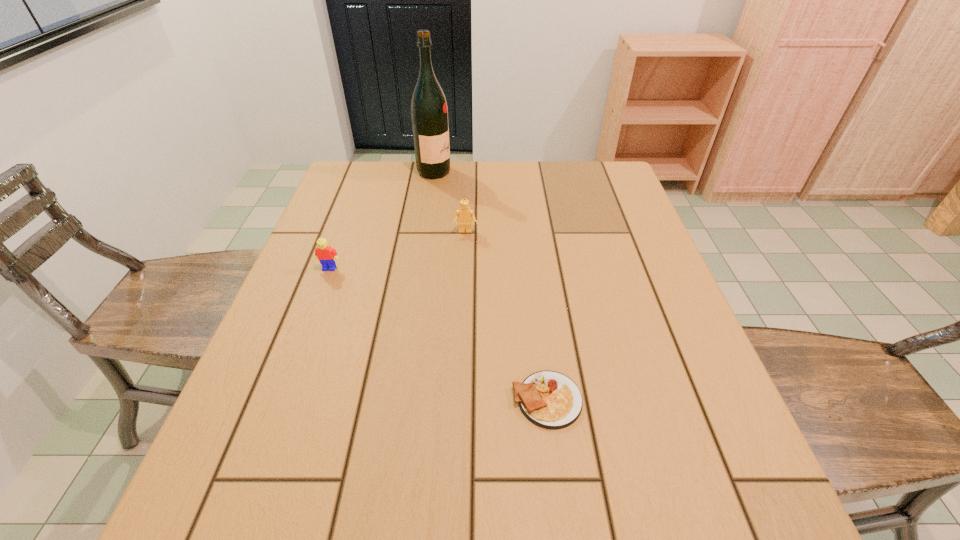
What are the coordinates of `free space between the nearest object and the liquor` in the screenshot? It's located at (491, 286).

What are the coordinates of `blank region between the farther Lego and the shortest object` in the screenshot? It's located at (506, 316).

Where is `unoccupied area between the omelet and the second object from left to right`? unoccupied area between the omelet and the second object from left to right is located at coordinates (491, 286).

Where is `vacant point located between the nearer Lego and the nearest object`? The height and width of the screenshot is (540, 960). vacant point located between the nearer Lego and the nearest object is located at coordinates (439, 334).

Find the location of a particular element. This screenshot has width=960, height=540. empty space between the farther Lego and the liquor is located at coordinates (449, 202).

Image resolution: width=960 pixels, height=540 pixels. In order to click on unoccupied position between the third farthest object and the shortest object in this screenshot , I will do `click(439, 334)`.

In order to click on free space between the nearer Lego and the shortest object in this screenshot , I will do `click(439, 334)`.

Find the location of `free space between the nearest object and the farthest object`. free space between the nearest object and the farthest object is located at coordinates (491, 286).

Identify the location of vacant point located between the left Lego and the right Lego. (397, 250).

This screenshot has width=960, height=540. Find the location of `the second closest object to the leftmost object`. the second closest object to the leftmost object is located at coordinates (429, 113).